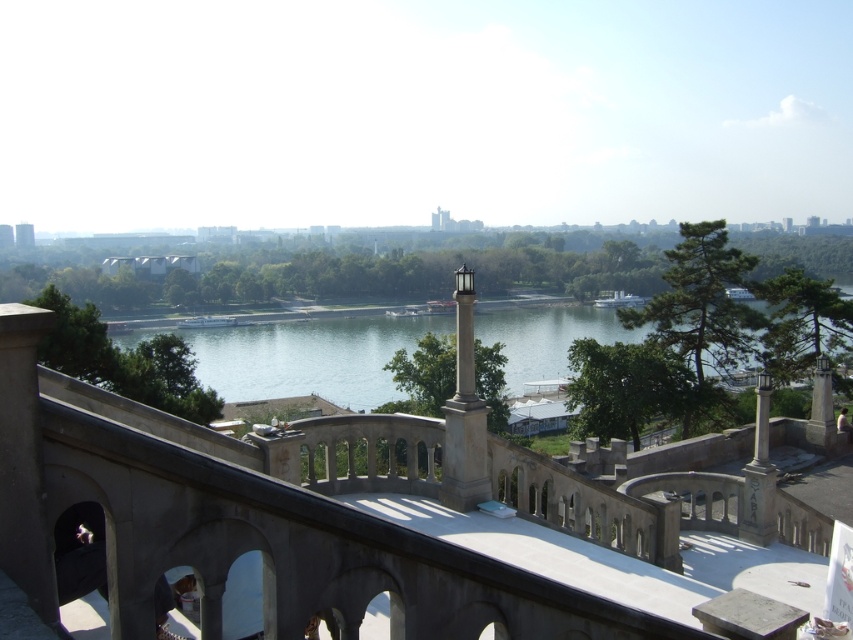
Based on the photo, which is below, concrete balcony at center or white stone column at center?

Positioned lower is concrete balcony at center.

Find the location of `concrete balcony at center`. concrete balcony at center is located at coordinates (335, 518).

Between concrete balcony at center and blue water at center, which one is positioned higher?

blue water at center

Who is shorter, concrete balcony at center or blue water at center?

With less height is concrete balcony at center.

Describe the element at coordinates (335, 518) in the screenshot. I see `concrete balcony at center` at that location.

The image size is (853, 640). I want to click on concrete balcony at center, so click(x=335, y=518).

Which is in front, point (525, 330) or point (457, 371)?

Point (457, 371) is in front.

Is blue water at center wider than white stone column at center?

Yes, blue water at center is wider than white stone column at center.

Does point (416, 333) come in front of point (442, 497)?

That is False.

Where is `blue water at center`? Image resolution: width=853 pixels, height=640 pixels. blue water at center is located at coordinates (309, 356).